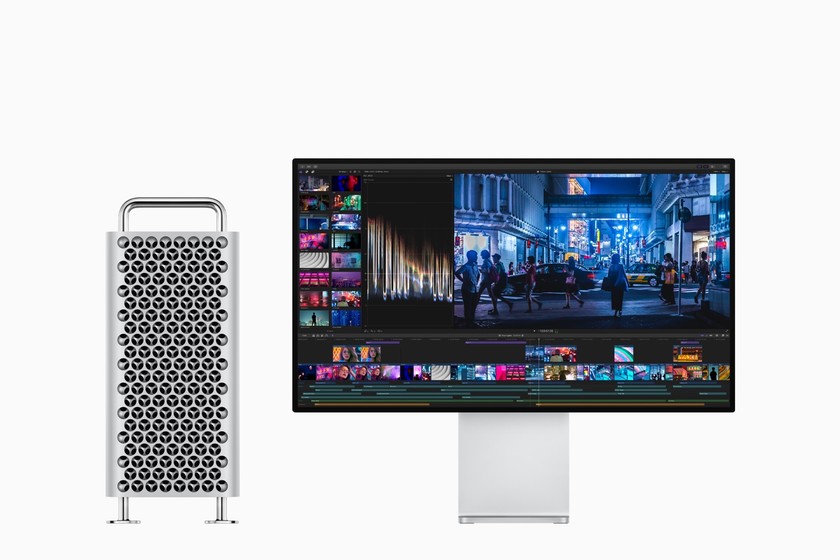
You are a GUI agent. You are given a task and a screenshot of the screen. Output one action in this format:
    pyautogui.click(x=<x>, y=<y>)
    Task: Click on the exit icon
    The height and width of the screenshot is (560, 840).
    Given the screenshot: What is the action you would take?
    pyautogui.click(x=725, y=165)